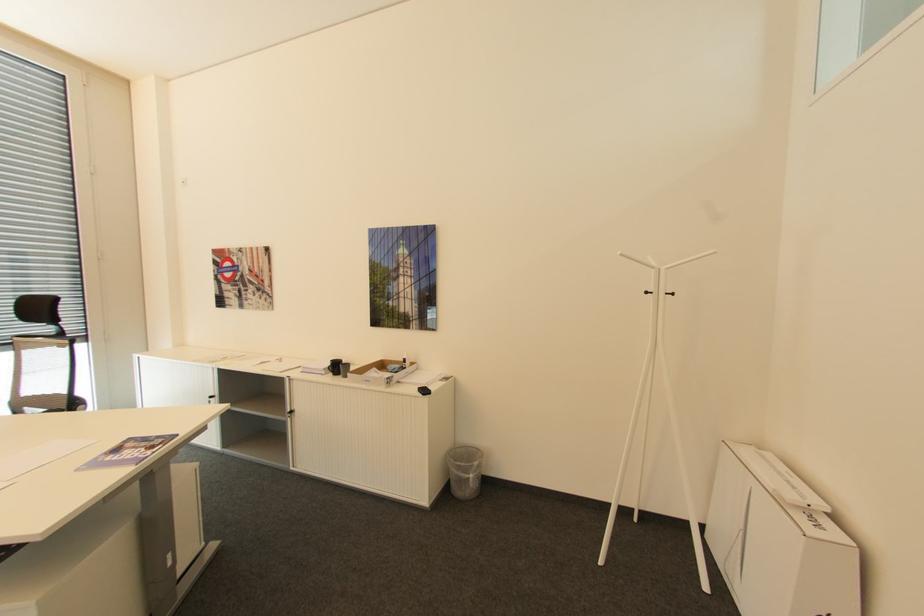
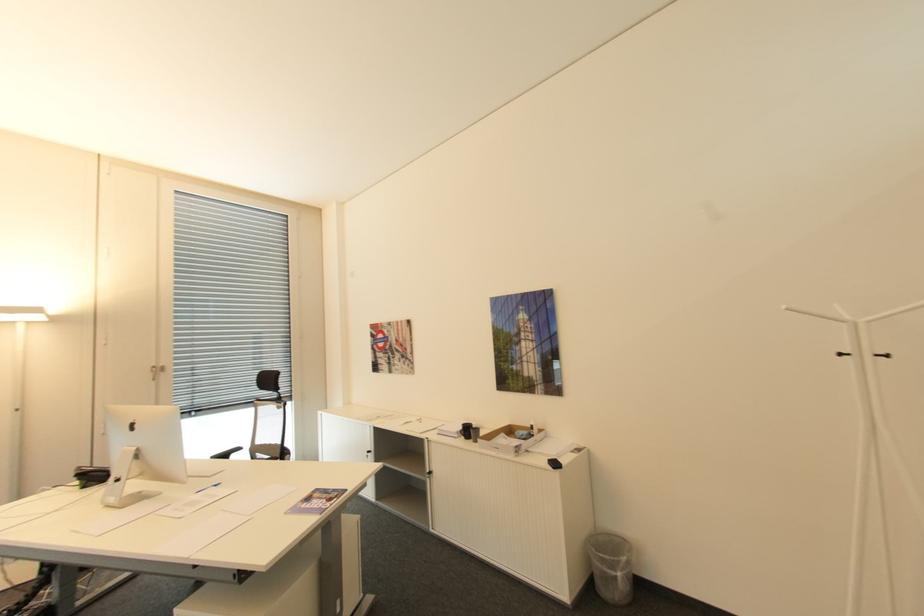
In the second image, find the point that corresponds to the point at 650,292 in the first image.

(846, 355)